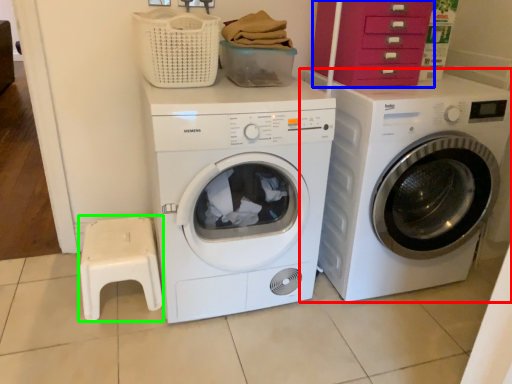
Question: Which object is positioned closest to washing machine (highlighted by a red box)? Select from drawer (highlighted by a blue box) and step stool (highlighted by a green box).

Choices:
 (A) drawer
 (B) step stool

Answer: (A)